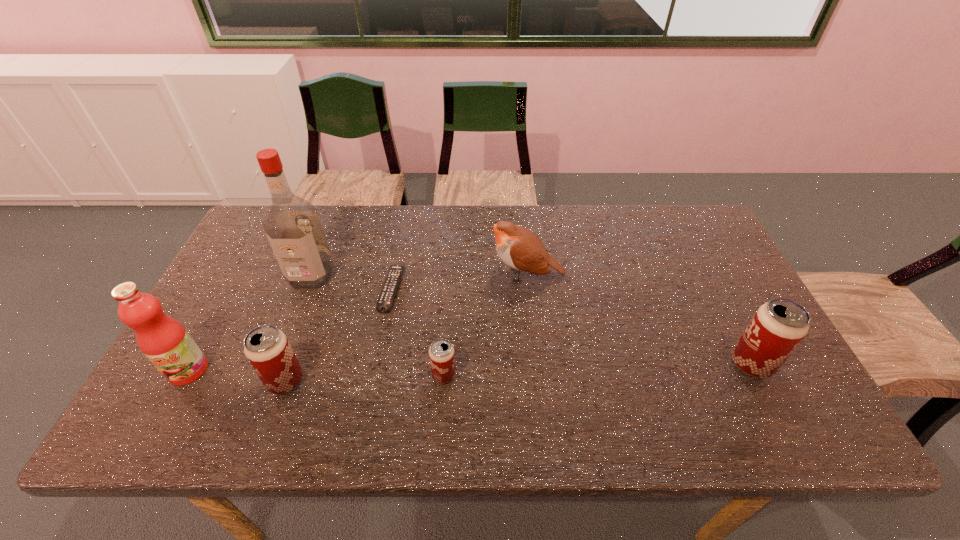
Identify the location of free space between the sixth object from left to right and the second shortest object. Image resolution: width=960 pixels, height=540 pixels. (485, 325).

Identify the location of vacant area between the rightmost beer can and the remote control. (571, 326).

At what (x,y) coordinates should I click in order to perform the action: click on unoccupied position between the leftmost beer can and the leftmost object. Please return your answer as a coordinate pair (x, y). Looking at the image, I should click on (237, 376).

Locate an element on the screen. This screenshot has height=540, width=960. free space between the liquor and the shortest object is located at coordinates (351, 282).

Identify the location of vacant area that lies between the second shortest object and the liquor. The width and height of the screenshot is (960, 540). (377, 325).

Image resolution: width=960 pixels, height=540 pixels. Find the location of `free space between the liquor and the second object from right to left`. free space between the liquor and the second object from right to left is located at coordinates (419, 275).

At what (x,y) coordinates should I click in order to perform the action: click on free space between the fifth object from left to right and the liquor. Please return your answer as a coordinate pair (x, y). The width and height of the screenshot is (960, 540). Looking at the image, I should click on (377, 325).

Where is `object that can be found as the closest to the liquor`? object that can be found as the closest to the liquor is located at coordinates (388, 292).

Locate an element on the screen. This screenshot has height=540, width=960. the second closest object to the second shortest beer can is located at coordinates (388, 292).

Point out which beer can is positioned as the nearest to the bird. Please provide its 2D coordinates. Your answer should be formatted as a tuple, i.e. [(x, y)], where the tuple contains the x and y coordinates of a point satisfying the conditions above.

[(441, 353)]